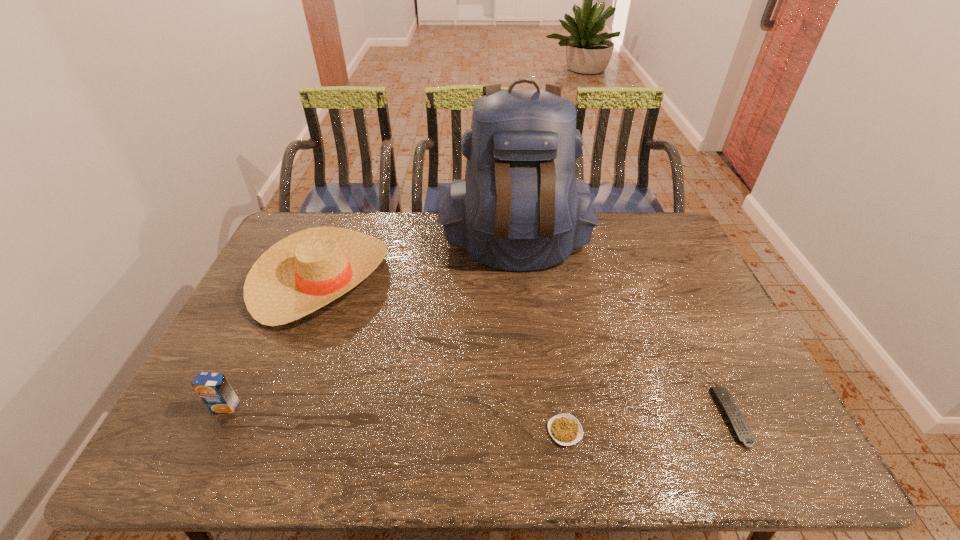
Where is `backpack that is at the far edge`? backpack that is at the far edge is located at coordinates (520, 207).

I want to click on sunhat located at the far edge, so click(x=305, y=271).

Locate an element on the screen. This screenshot has height=540, width=960. remote control located at the near edge is located at coordinates (722, 395).

Identify the location of legume at the near edge. (565, 429).

You are a GUI agent. You are given a task and a screenshot of the screen. Output one action in this format:
    pyautogui.click(x=<x>, y=<y>)
    Task: Click on the sunhat at the left edge
    The width and height of the screenshot is (960, 540).
    Given the screenshot: What is the action you would take?
    point(305,271)

Identify the location of orange_juice at the left edge. This screenshot has height=540, width=960. 213,388.

Identify the location of object that is at the right edge. coord(722,395).

Where is `object that is at the far left corner`? object that is at the far left corner is located at coordinates (305, 271).

You are a GUI agent. You are given a task and a screenshot of the screen. Output one action in this format:
    pyautogui.click(x=<x>, y=<y>)
    Task: Click on the object at the near right corner
    This screenshot has width=960, height=540.
    Given the screenshot: What is the action you would take?
    (722, 395)

In order to click on free space at the far edge of the desktop in this screenshot , I will do `click(420, 233)`.